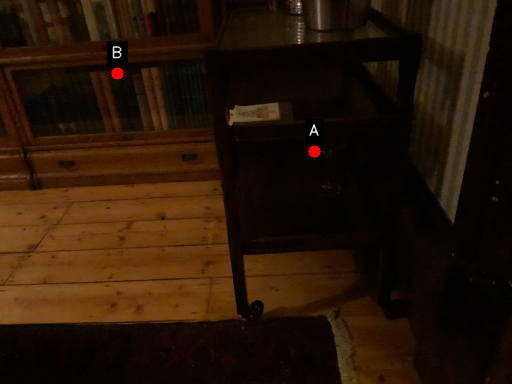
Question: Two points are circled on the image, labeled by A and B beside each circle. Which point is closer to the camera?

Choices:
 (A) A is closer
 (B) B is closer

Answer: (A)